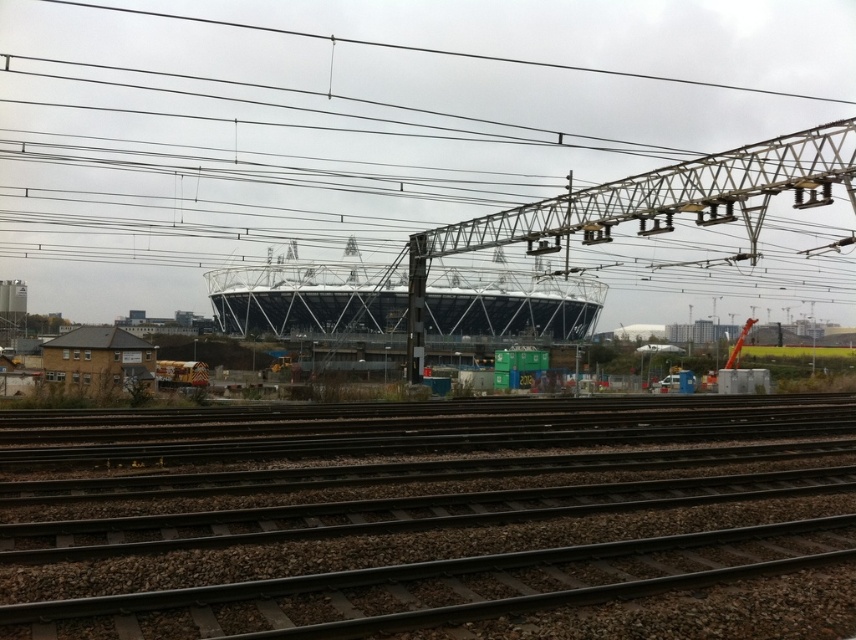
Question: Does metallic wire at center lie behind black metal train tracks at lower center?

Choices:
 (A) no
 (B) yes

Answer: (B)

Question: Does metallic wire at center have a greater width compared to black metal train tracks at lower center?

Choices:
 (A) no
 (B) yes

Answer: (B)

Question: Does metallic wire at center have a larger size compared to black metal train tracks at lower center?

Choices:
 (A) no
 (B) yes

Answer: (B)

Question: Which point is closer to the camera?

Choices:
 (A) (485, 608)
 (B) (464, 204)

Answer: (A)

Question: Among these points, which one is nearest to the camera?

Choices:
 (A) (244, 433)
 (B) (736, 236)

Answer: (A)

Question: Which object is closer to the camera taking this photo?

Choices:
 (A) black metal train tracks at lower center
 (B) metallic wire at center

Answer: (A)